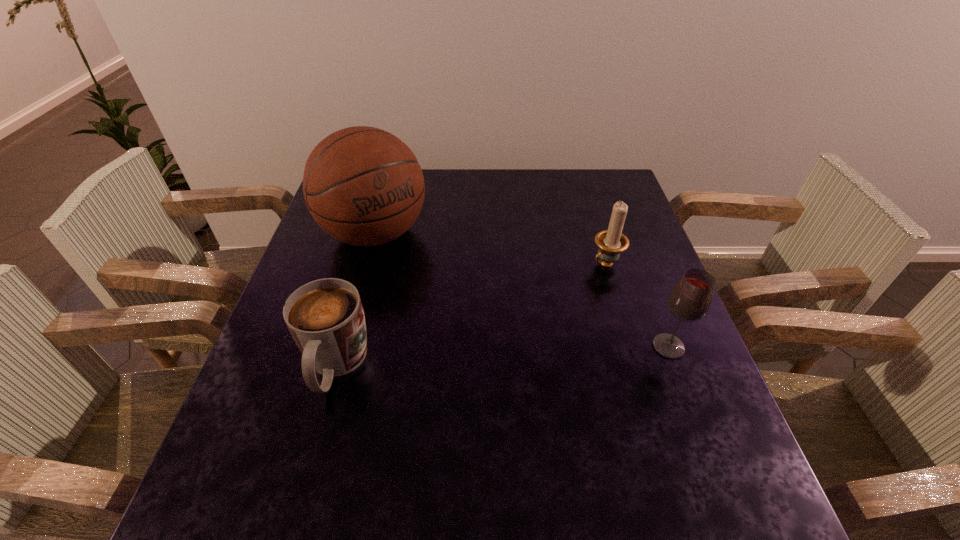
Where is `vacant region located 0.190m on the side with brand label of the tallest object`? vacant region located 0.190m on the side with brand label of the tallest object is located at coordinates (438, 307).

This screenshot has height=540, width=960. What are the coordinates of `vacant space located on the side with brand label of the tallest object` in the screenshot? It's located at (425, 293).

The width and height of the screenshot is (960, 540). I want to click on object that is at the far edge, so click(x=364, y=186).

Find the location of `mug that is at the left edge`. mug that is at the left edge is located at coordinates (325, 317).

Find the location of `basketball present at the left edge`. basketball present at the left edge is located at coordinates (364, 186).

Where is `glass drink container that is at the right edge`? Image resolution: width=960 pixels, height=540 pixels. glass drink container that is at the right edge is located at coordinates (690, 299).

Locate an element on the screen. Image resolution: width=960 pixels, height=540 pixels. candle_holder at the right edge is located at coordinates (611, 242).

This screenshot has width=960, height=540. Identify the location of object at the far left corner. (364, 186).

The image size is (960, 540). In the image, there is a desktop. In order to click on vacant space at the far edge in this screenshot , I will do `click(448, 185)`.

Locate an element on the screen. free region at the near edge is located at coordinates (320, 449).